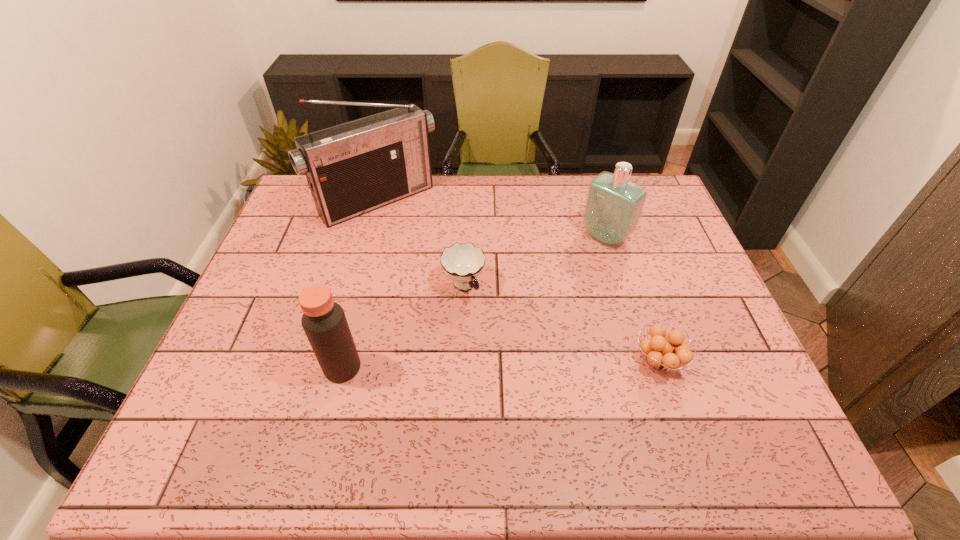
Identify the location of vacant space located 0.070m on the side of the cup with the handle. The image size is (960, 540). (486, 322).

The width and height of the screenshot is (960, 540). In order to click on vacant space located on the front-facing side of the radio receiver in this screenshot , I will do `click(436, 255)`.

Identify the location of vacant space located 0.370m on the front-facing side of the radio receiver. (473, 296).

Where is `blank space located 0.150m on the front-facing side of the radio receiver`? The width and height of the screenshot is (960, 540). blank space located 0.150m on the front-facing side of the radio receiver is located at coordinates (432, 251).

I want to click on free region located on the front label of the perfume, so click(549, 287).

The height and width of the screenshot is (540, 960). In order to click on free space located 0.080m on the front label of the perfume in this screenshot , I will do `click(576, 263)`.

This screenshot has width=960, height=540. Find the location of `vacant space situated 0.270m on the front label of the perfume`. vacant space situated 0.270m on the front label of the perfume is located at coordinates (536, 299).

Where is `object that is at the far edge`? object that is at the far edge is located at coordinates [353, 168].

Locate an element on the screen. The image size is (960, 540). vinegar located in the near edge section of the desktop is located at coordinates (x=324, y=322).

Locate an element on the screen. This screenshot has height=540, width=960. orange fruit situated at the near edge is located at coordinates (659, 351).